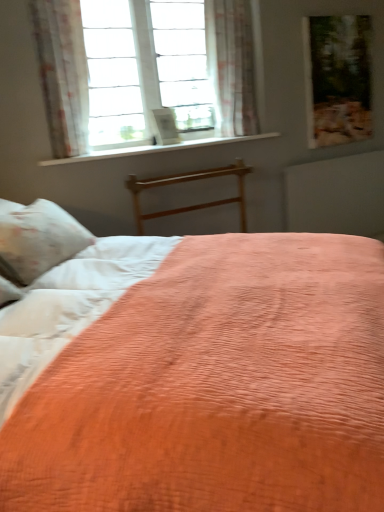
Where is `free spot above matte wood radiator at upper right (from a real-world perspective)`? The image size is (384, 512). free spot above matte wood radiator at upper right (from a real-world perspective) is located at coordinates (348, 154).